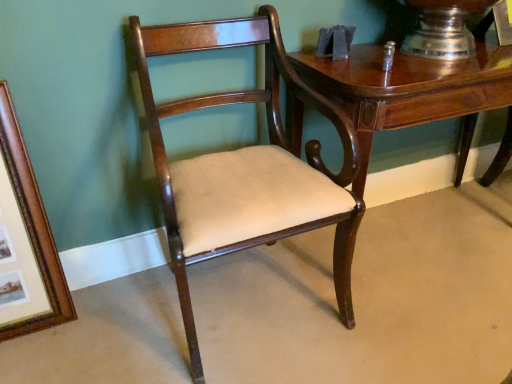
This screenshot has width=512, height=384. What are the coordinates of `vacant space underneath glossy wood table at upper right (from a real-world perspective)` in the screenshot? It's located at (411, 231).